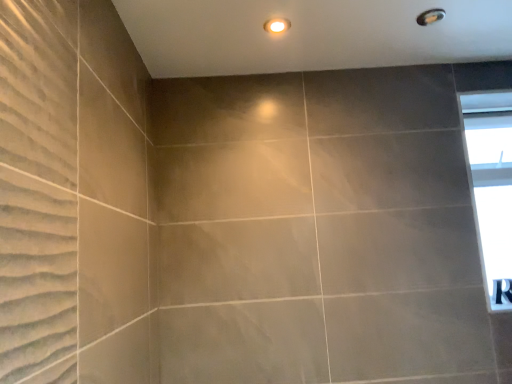
Question: Is matte white light fixture at upper center aimed at transparent glass window at upper right?

Choices:
 (A) no
 (B) yes

Answer: (A)

Question: From a real-world perspective, is matte white light fixture at upper center located higher than transparent glass window at upper right?

Choices:
 (A) no
 (B) yes

Answer: (B)

Question: From a real-world perspective, is matte white light fixture at upper center beneath transparent glass window at upper right?

Choices:
 (A) yes
 (B) no

Answer: (B)

Question: Would you consider matte white light fixture at upper center to be distant from transparent glass window at upper right?

Choices:
 (A) yes
 (B) no

Answer: (A)

Question: Does matte white light fixture at upper center come in front of transparent glass window at upper right?

Choices:
 (A) no
 (B) yes

Answer: (B)

Question: Do you think matte gray shower at upper right is within matte white light fixture at upper center, or outside of it?

Choices:
 (A) outside
 (B) inside

Answer: (A)

Question: Relative to matte white light fixture at upper center, is matte gray shower at upper right in front or behind?

Choices:
 (A) front
 (B) behind

Answer: (B)

Question: From the image's perspective, is matte gray shower at upper right above or below matte white light fixture at upper center?

Choices:
 (A) above
 (B) below

Answer: (A)

Question: Based on their sizes in the image, would you say matte gray shower at upper right is bigger or smaller than matte white light fixture at upper center?

Choices:
 (A) big
 (B) small

Answer: (B)

Question: In the image, is matte white light fixture at upper center positioned in front of or behind matte gray shower at upper right?

Choices:
 (A) front
 (B) behind

Answer: (A)

Question: Is matte white light fixture at upper center wider or thinner than matte gray shower at upper right?

Choices:
 (A) wide
 (B) thin

Answer: (B)

Question: Which is correct: matte white light fixture at upper center is inside matte gray shower at upper right, or outside of it?

Choices:
 (A) outside
 (B) inside

Answer: (A)

Question: From their relative heights in the image, would you say matte white light fixture at upper center is taller or shorter than matte gray shower at upper right?

Choices:
 (A) short
 (B) tall

Answer: (B)

Question: Considering the positions of point (420, 24) and point (472, 153), is point (420, 24) closer or farther from the camera than point (472, 153)?

Choices:
 (A) closer
 (B) farther

Answer: (A)

Question: From the image's perspective, is matte gray shower at upper right located above or below transparent glass window at upper right?

Choices:
 (A) below
 (B) above

Answer: (B)